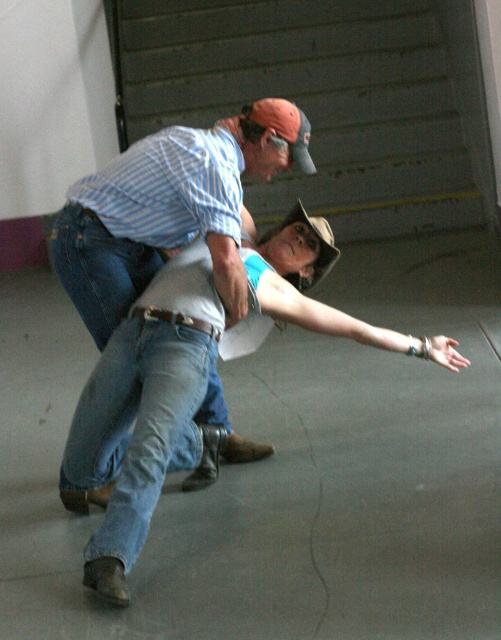
You are standing in the room and want to move from point A at point (60, 493) to point B at point (192, 211). Which point is closer to you when you start at point A?

Point A at point (60, 493) is closer to you because it is the starting point, while point B at point (192, 211) is further away.

You are a fashion designer analyzing the image. You need to determine which clothing item occupies more vertical space in the composition. Based on the scene, which of the two items, the denim jeans at center or the blue striped shirt at upper left, is taller?

The denim jeans at center is taller than the blue striped shirt at upper left according to the description.

Based on the scene description, where exactly is the denim jeans at center located in terms of coordinates?

The denim jeans at center is located at point (146, 413).